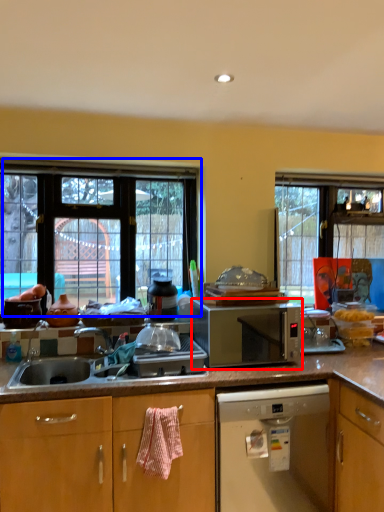
Question: Which of the following is the farthest to the observer, microwave oven (highlighted by a red box) or window (highlighted by a blue box)?

Choices:
 (A) microwave oven
 (B) window

Answer: (B)